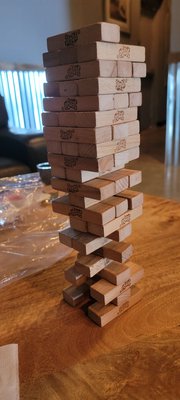
Locate an element on the screen. This screenshot has width=180, height=400. white wall is located at coordinates (43, 9), (22, 23), (31, 48).